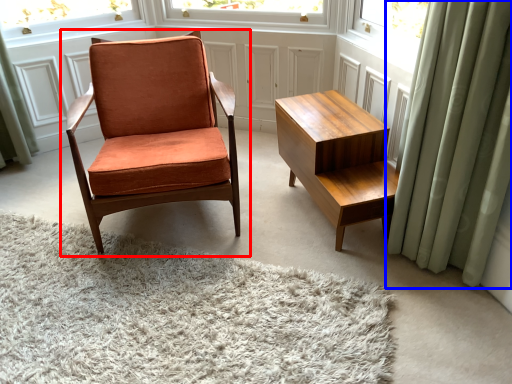
Question: Which point is closer to the camera, chair (highlighted by a red box) or curtain (highlighted by a blue box)?

Choices:
 (A) chair
 (B) curtain

Answer: (B)